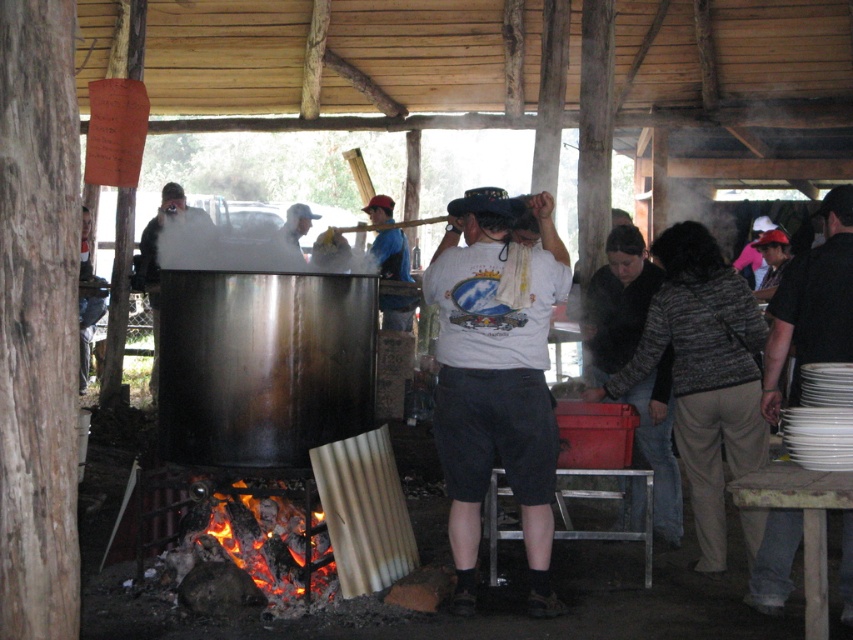
You are standing at the camera position and want to reach the point marked as point (842, 336). If you can walk 15 feet in 1 minute, how long will it take you to reach the point?

The point (842, 336) is 15.05 feet away from the camera. Since you can walk 15 feet in 1 minute, it would take approximately 1 minute to reach the point.